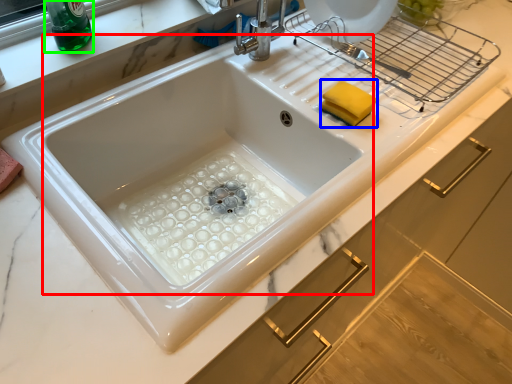
Question: Estimate the real-world distances between objects in this image. Which object is farther from sink (highlighted by a red box), food (highlighted by a blue box) or beverage (highlighted by a green box)?

Choices:
 (A) food
 (B) beverage

Answer: (B)